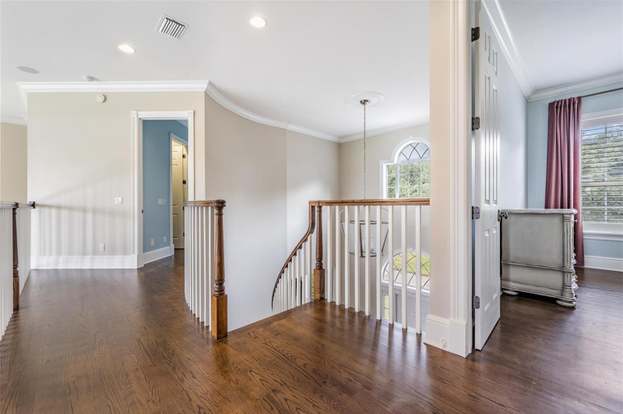
The width and height of the screenshot is (623, 414). Find the location of `ceiling lights`. ceiling lights is located at coordinates (260, 20), (128, 50).